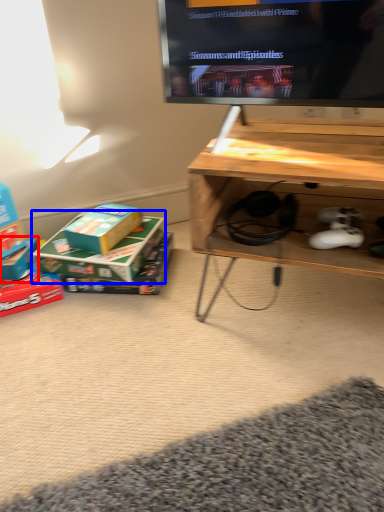
Question: Which of the following is the closest to the observer, box (highlighted by a red box) or box (highlighted by a blue box)?

Choices:
 (A) box
 (B) box

Answer: (B)